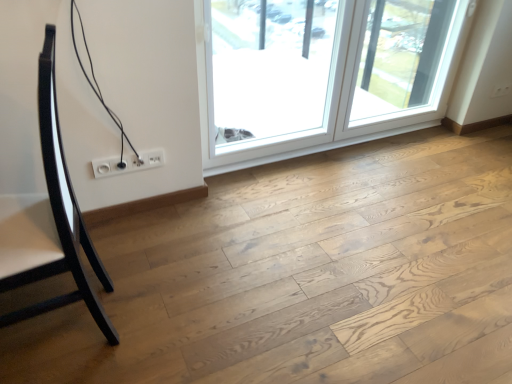
Question: Does transparent glass window at upper right, the first window from the right, have a greater height compared to white plastic socket at lower center?

Choices:
 (A) yes
 (B) no

Answer: (A)

Question: Is transparent glass window at upper right, the first window from the right, thinner than white plastic socket at lower center?

Choices:
 (A) yes
 (B) no

Answer: (B)

Question: Is transparent glass window at upper right, the first window from the right, to the right of white plastic socket at lower center from the viewer's perspective?

Choices:
 (A) no
 (B) yes

Answer: (B)

Question: Can we say transparent glass window at upper right, the 2th window viewed from the left, lies outside white plastic socket at lower center?

Choices:
 (A) yes
 (B) no

Answer: (A)

Question: From the image's perspective, is transparent glass window at upper right, the first window from the right, below white plastic socket at lower center?

Choices:
 (A) yes
 (B) no

Answer: (B)

Question: From the image's perspective, would you say transparent glass window at upper right, the first window from the right, is positioned over white plastic socket at lower center?

Choices:
 (A) no
 (B) yes

Answer: (B)

Question: Does transparent glass screen door at upper right have a lesser width compared to natural wood floor at center?

Choices:
 (A) no
 (B) yes

Answer: (B)

Question: Is transparent glass screen door at upper right closer to camera compared to natural wood floor at center?

Choices:
 (A) no
 (B) yes

Answer: (A)

Question: From the image's perspective, is transparent glass screen door at upper right located beneath natural wood floor at center?

Choices:
 (A) yes
 (B) no

Answer: (B)

Question: From a real-world perspective, does transparent glass screen door at upper right stand above natural wood floor at center?

Choices:
 (A) yes
 (B) no

Answer: (A)

Question: From a real-world perspective, is transparent glass screen door at upper right below natural wood floor at center?

Choices:
 (A) no
 (B) yes

Answer: (A)

Question: Is transparent glass screen door at upper right not within natural wood floor at center?

Choices:
 (A) no
 (B) yes

Answer: (B)

Question: Does natural wood floor at center appear on the right side of glossy black chair at left?

Choices:
 (A) no
 (B) yes

Answer: (B)